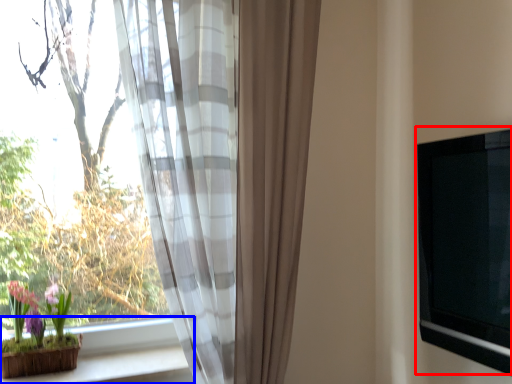
Question: Which object is further to the camera taking this photo, window screen (highlighted by a red box) or window sill (highlighted by a blue box)?

Choices:
 (A) window screen
 (B) window sill

Answer: (B)